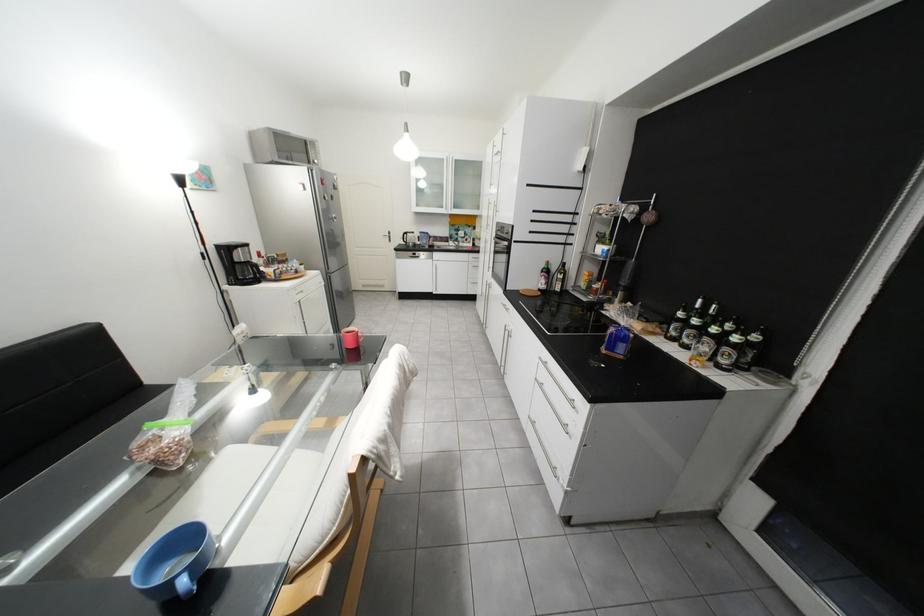
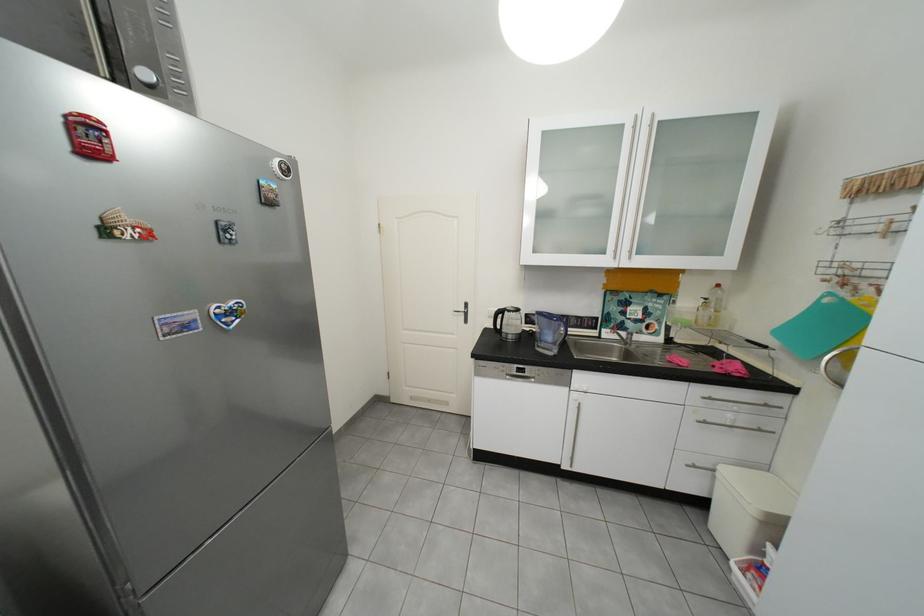
The point at (418, 235) is marked in the first image. Where is the corresponding point in the second image?

(513, 313)